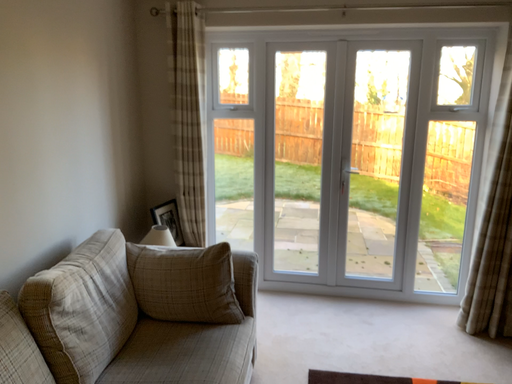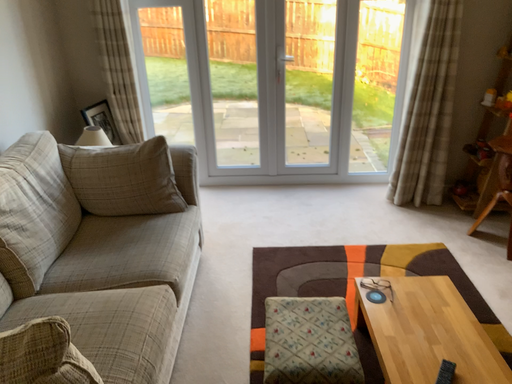
Question: Which way did the camera rotate in the video?

Choices:
 (A) rotated upward
 (B) rotated downward

Answer: (B)